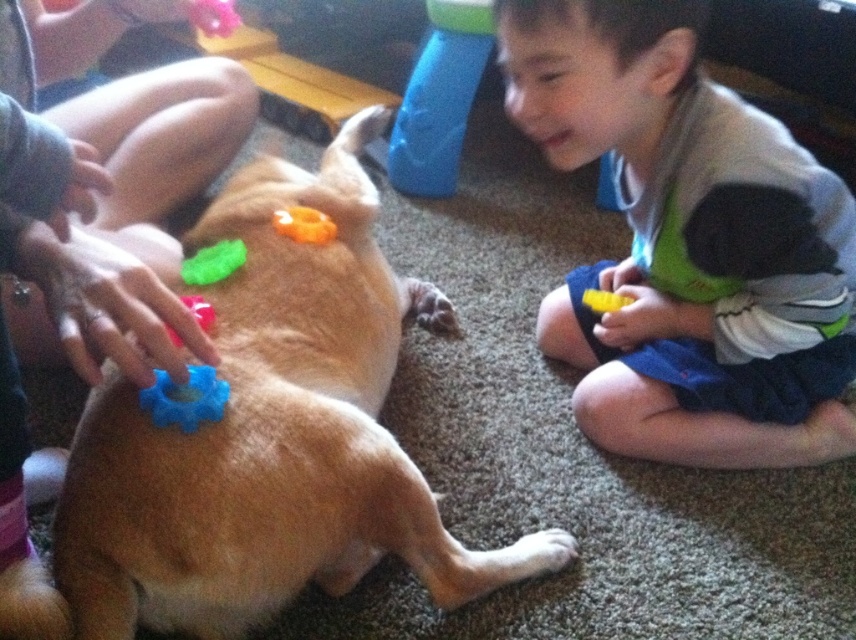
Question: From the image, what is the correct spatial relationship of brown matte dog at center in relation to blue plastic toy at upper center?

Choices:
 (A) below
 (B) above

Answer: (A)

Question: Where is translucent orange plastic at upper center located in relation to blue plastic toy at upper left in the image?

Choices:
 (A) above
 (B) below

Answer: (A)

Question: Which of these objects is positioned farthest from the blue plastic toy at upper center?

Choices:
 (A) green rubber toy at upper left
 (B) translucent orange plastic at upper center

Answer: (A)

Question: Is brown matte dog at center positioned in front of blue plastic toy at upper left?

Choices:
 (A) no
 (B) yes

Answer: (B)

Question: Which object is the closest to the blue rubber toy at lower left?

Choices:
 (A) blue plastic toy at upper left
 (B) blue plastic toy at upper center
 (C) green fabric shorts at lower right

Answer: (A)

Question: Which object appears farthest from the camera in this image?

Choices:
 (A) yellow plastic toy at lower center
 (B) green rubber toy at upper left

Answer: (A)